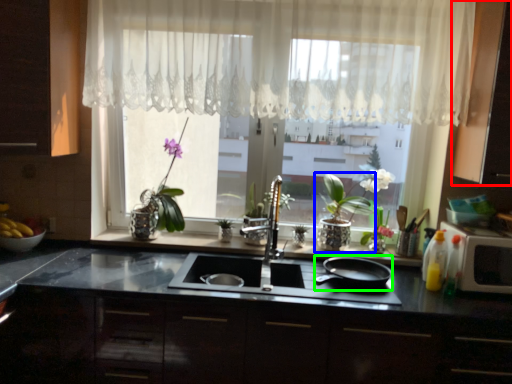
Question: Which object is the farthest from cabinetry (highlighted by a red box)? Choose among these: houseplant (highlighted by a blue box) or frying pan (highlighted by a green box).

Choices:
 (A) houseplant
 (B) frying pan

Answer: (B)